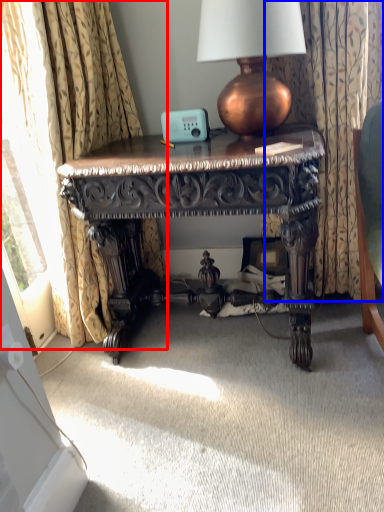
Question: Which of the following is the closest to the observer, curtain (highlighted by a red box) or curtain (highlighted by a blue box)?

Choices:
 (A) curtain
 (B) curtain

Answer: (A)